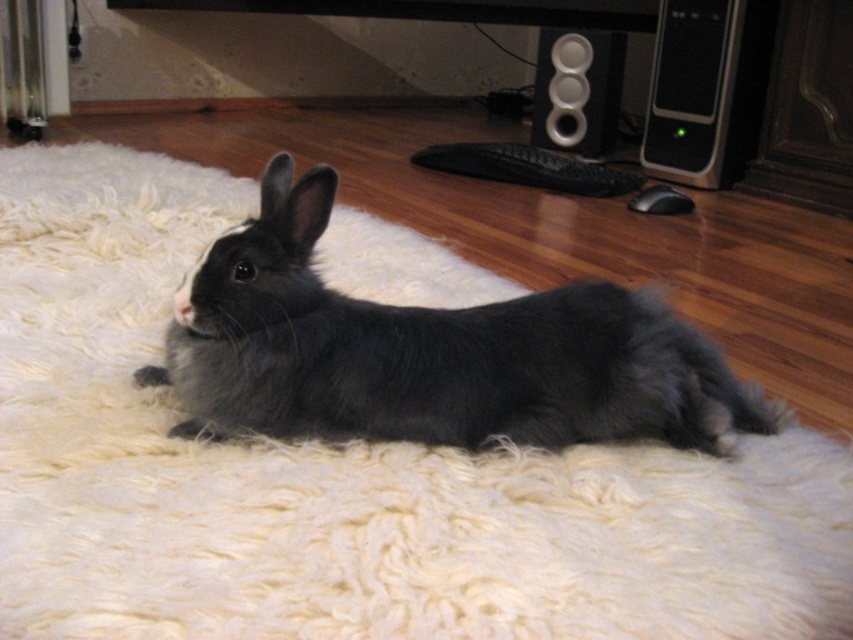
Does black soft fur rabbit at center come behind satin black speaker at center right?

No.

Measure the distance from black soft fur rabbit at center to satin black speaker at center right.

They are 1.61 meters apart.

At what (x,y) coordinates should I click in order to perform the action: click on black soft fur rabbit at center. Please return your answer as a coordinate pair (x, y). The image size is (853, 640). Looking at the image, I should click on (428, 353).

At what (x,y) coordinates should I click in order to perform the action: click on black soft fur rabbit at center. Please return your answer as a coordinate pair (x, y). Image resolution: width=853 pixels, height=640 pixels. Looking at the image, I should click on (428, 353).

Can you confirm if black soft fur rabbit at center is bigger than black plastic speaker at upper right?

Yes.

Can you confirm if black soft fur rabbit at center is smaller than black plastic speaker at upper right?

No.

Is point (645, 326) positioned before point (579, 108)?

That is True.

This screenshot has width=853, height=640. I want to click on black soft fur rabbit at center, so click(x=428, y=353).

Between satin black speaker at center right and black plastic speaker at upper right, which one is positioned lower?

Positioned lower is satin black speaker at center right.

Describe the element at coordinates (691, 90) in the screenshot. The height and width of the screenshot is (640, 853). I see `satin black speaker at center right` at that location.

Find the location of a particular element. satin black speaker at center right is located at coordinates (691, 90).